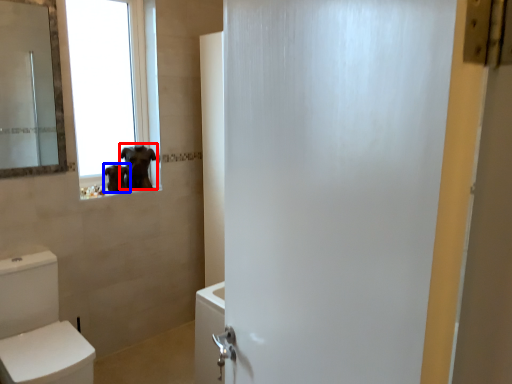
Question: Which of the following is the closest to the observer, animal (highlighted by a red box) or animal (highlighted by a blue box)?

Choices:
 (A) animal
 (B) animal

Answer: (B)